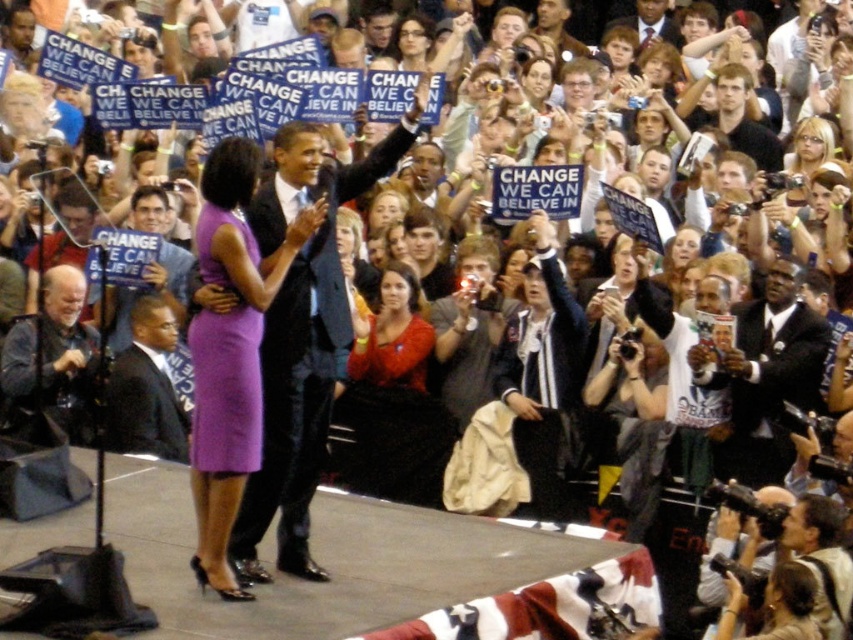
Question: Is purple satin dress at center closer to camera compared to dark suit at lower left?

Choices:
 (A) no
 (B) yes

Answer: (B)

Question: Which point is farther to the camera?

Choices:
 (A) gray fabric at lower left
 (B) matte black suit at center

Answer: (A)

Question: Does matte red dress at center have a greater width compared to gray fabric at lower left?

Choices:
 (A) yes
 (B) no

Answer: (A)

Question: Among these points, which one is nearest to the camera?

Choices:
 (A) (251, 420)
 (B) (169, 308)

Answer: (A)

Question: Which point is farther to the camera?

Choices:
 (A) matte black suit at center
 (B) matte red dress at center

Answer: (B)

Question: Can you confirm if gray fabric at lower left is wider than dark suit at lower left?

Choices:
 (A) no
 (B) yes

Answer: (B)